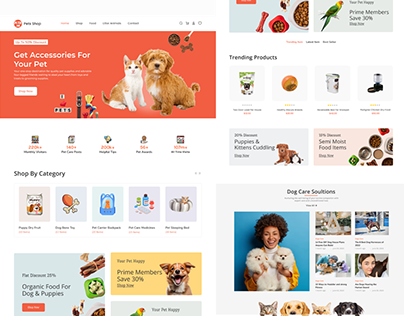
This screenshot has height=316, width=404. What are the coordinates of `pet food dispenser` in the screenshot? It's located at (379, 85).